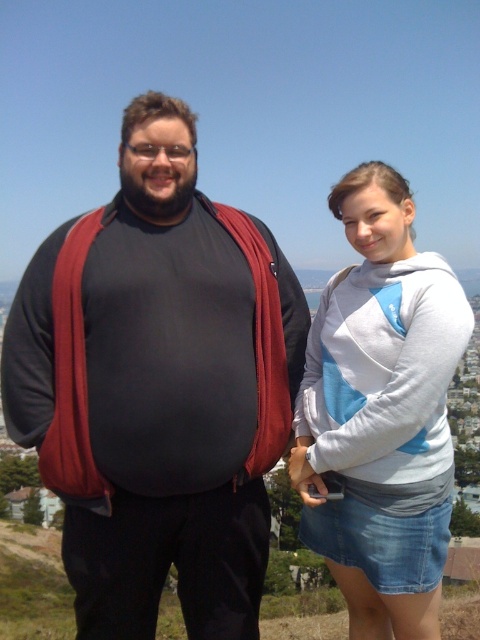
Describe the element at coordinates (157, 387) in the screenshot. I see `matte black backpack at left` at that location.

Is matte black backpack at left shorter than gray cotton hoodie at upper right?

Incorrect, matte black backpack at left's height does not fall short of gray cotton hoodie at upper right's.

Does point (72, 333) lie behind point (385, 436)?

Yes.

Find the location of a particular element. matte black backpack at left is located at coordinates (157, 387).